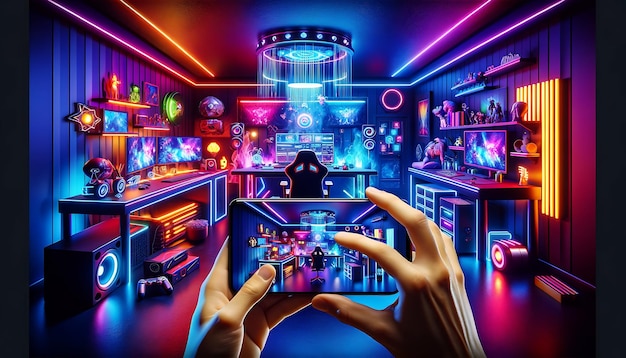
You are a GUI agent. You are given a task and a screenshot of the screen. Output one action in this format:
    pyautogui.click(x=<x>, y=<y>)
    Task: Click on the desk chair
    The height and width of the screenshot is (358, 626).
    Given the screenshot: What is the action you would take?
    pyautogui.click(x=309, y=180)